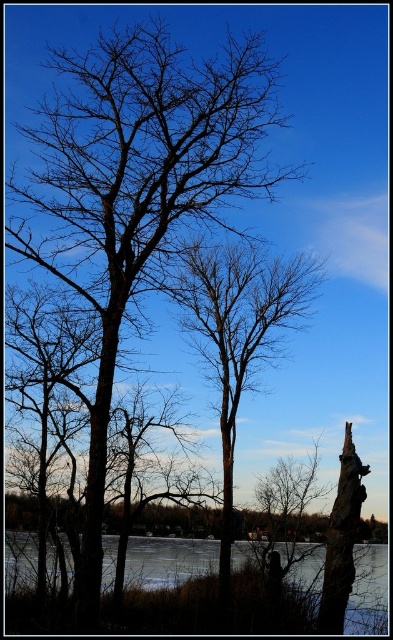
Question: In this image, where is brown/dry wood tree at center located relative to frozen ice at lower center?

Choices:
 (A) below
 (B) above

Answer: (B)

Question: Which of these objects is positioned closest to the brown rough bark tree at center?

Choices:
 (A) smooth bark tree trunk at right
 (B) frozen ice at lower center

Answer: (A)

Question: Which of the following is the closest to the observer?

Choices:
 (A) (113, 44)
 (B) (9, 561)
 (C) (350, 433)
 (D) (231, 481)

Answer: (A)

Question: Can you confirm if brown/dry wood tree at center is positioned below frozen ice at lower center?

Choices:
 (A) no
 (B) yes

Answer: (A)

Question: Which object appears closest to the camera in this image?

Choices:
 (A) frozen ice at lower center
 (B) brown/dry wood tree at center

Answer: (B)

Question: Does brown/dry wood tree at center have a larger size compared to smooth bark tree trunk at right?

Choices:
 (A) no
 (B) yes

Answer: (A)